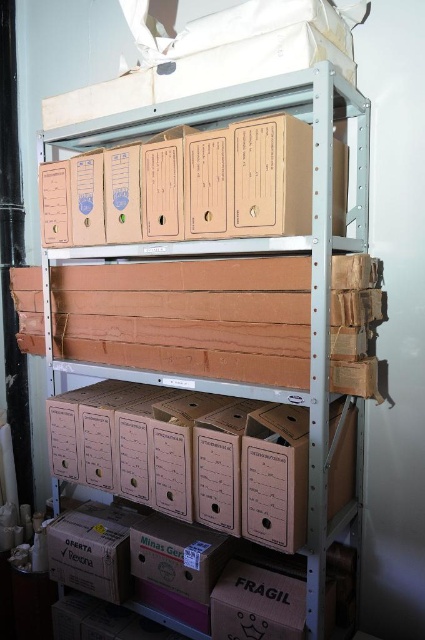
Question: Does cardboard box at center have a smaller size compared to brown cardboard boxes at center?

Choices:
 (A) no
 (B) yes

Answer: (B)

Question: Which object is closer to the camera taking this photo?

Choices:
 (A) brown cardboard boxes at center
 (B) cardboard box at center

Answer: (A)

Question: Is cardboard box at center positioned in front of brown cardboard boxes at center?

Choices:
 (A) yes
 (B) no

Answer: (B)

Question: Where is cardboard box at center located in relation to brown cardboard boxes at center in the image?

Choices:
 (A) left
 (B) right

Answer: (A)